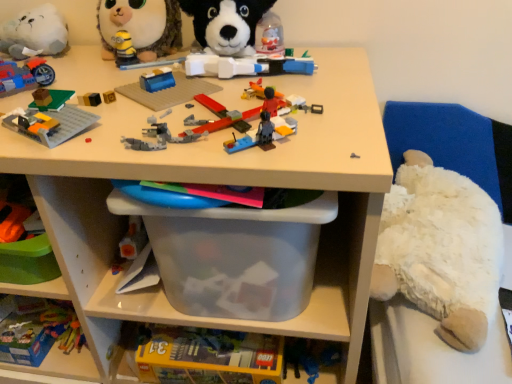
Identify the location of matte blue motorcycle at upper left, the 3th toy positioned from the left. The width and height of the screenshot is (512, 384). (24, 76).

Describe the element at coordinates (39, 331) in the screenshot. This screenshot has height=384, width=512. I see `translucent plastic lego box at lower left, the first toy when ordered from left to right` at that location.

In order to face translucent plastic lego box at lower left, the 8th toy positioned from the right, should I rotate leftwards or rightwards?

You should rotate left by 31.712 degrees.

The height and width of the screenshot is (384, 512). What do you see at coordinates (440, 250) in the screenshot?
I see `white fluffy teddy bear at right, which ranks as the first toy in right-to-left order` at bounding box center [440, 250].

Locate an element on the screen. matte blue motorcycle at upper left, the 3th toy positioned from the left is located at coordinates click(x=24, y=76).

From the picture: How many degrees apart are the facing directions of translucent plastic lego box at lower left, the first toy when ordered from left to right, and white plush cat at upper left, acting as the 2th toy starting from the left?

There is a 1.31-degree angle between the facing directions of translucent plastic lego box at lower left, the first toy when ordered from left to right, and white plush cat at upper left, acting as the 2th toy starting from the left.

Measure the distance from translucent plastic lego box at lower left, the 8th toy positioned from the right, to white plush cat at upper left, acting as the 2th toy starting from the left.

A distance of 21.14 inches exists between translucent plastic lego box at lower left, the 8th toy positioned from the right, and white plush cat at upper left, acting as the 2th toy starting from the left.

Locate an element on the screen. The width and height of the screenshot is (512, 384). toy behind the translucent plastic lego box at lower left, the first toy when ordered from left to right is located at coordinates (35, 33).

Considering the sizes of translucent plastic lego box at lower left, the 8th toy positioned from the right, and white plush cat at upper left, the seventh toy viewed from the right, in the image, is translucent plastic lego box at lower left, the 8th toy positioned from the right, taller or shorter than white plush cat at upper left, the seventh toy viewed from the right,?

Considering their sizes, translucent plastic lego box at lower left, the 8th toy positioned from the right, has less height than white plush cat at upper left, the seventh toy viewed from the right.

Measure the distance from matte blue motorcycle at upper left, the 3th toy positioned from the left, to fluffy plush toy at upper left, the fourth toy in the right-to-left sequence.

The distance of matte blue motorcycle at upper left, the 3th toy positioned from the left, from fluffy plush toy at upper left, the fourth toy in the right-to-left sequence, is 7.38 inches.

In terms of width, does matte blue motorcycle at upper left, the 3th toy positioned from the left, look wider or thinner when compared to fluffy plush toy at upper left, the fourth toy in the right-to-left sequence?

Clearly, matte blue motorcycle at upper left, the 3th toy positioned from the left, has less width compared to fluffy plush toy at upper left, the fourth toy in the right-to-left sequence.

Between matte blue motorcycle at upper left, the 3th toy positioned from the left, and fluffy plush toy at upper left, the fifth toy positioned from the left, which one is positioned in front?

matte blue motorcycle at upper left, the 3th toy positioned from the left, is closer to the camera.

Considering the sizes of matte blue motorcycle at upper left, arranged as the sixth toy when viewed from the right, and fluffy plush toy at upper left, the fourth toy in the right-to-left sequence, in the image, is matte blue motorcycle at upper left, arranged as the sixth toy when viewed from the right, taller or shorter than fluffy plush toy at upper left, the fourth toy in the right-to-left sequence,?

A: Clearly, matte blue motorcycle at upper left, arranged as the sixth toy when viewed from the right, is shorter compared to fluffy plush toy at upper left, the fourth toy in the right-to-left sequence.

This screenshot has height=384, width=512. I want to click on toy that is the 6th object located in front of the white plush cat at upper left, acting as the 2th toy starting from the left, so click(51, 120).

From the image's perspective, is translucent plastic baseplate at upper left, which is the fourth toy in left-to-right order, on white plush cat at upper left, acting as the 2th toy starting from the left?

Incorrect, from the image's perspective, translucent plastic baseplate at upper left, which is the fourth toy in left-to-right order, is lower than white plush cat at upper left, acting as the 2th toy starting from the left.

Is translucent plastic baseplate at upper left, which is the fourth toy in left-to-right order, looking in the opposite direction of white plush cat at upper left, acting as the 2th toy starting from the left?

No, translucent plastic baseplate at upper left, which is the fourth toy in left-to-right order, is not facing away from white plush cat at upper left, acting as the 2th toy starting from the left.

Is translucent plastic baseplate at upper left, the fifth toy from the right, far away from white plush cat at upper left, acting as the 2th toy starting from the left?

A: That's not correct — translucent plastic baseplate at upper left, the fifth toy from the right, is a little close to white plush cat at upper left, acting as the 2th toy starting from the left.

Can you confirm if white fluffy teddy bear at right, which ranks as the first toy in right-to-left order, is thinner than white plush dog at upper center, which is the 2th toy from right to left?

No.

Is white fluffy teddy bear at right, placed as the 8th toy when sorted from left to right, not inside white plush dog at upper center, the seventh toy viewed from the left?

Yes, white fluffy teddy bear at right, placed as the 8th toy when sorted from left to right, is located beyond the bounds of white plush dog at upper center, the seventh toy viewed from the left.

Considering the points (475, 295) and (260, 55), which point is in front, point (475, 295) or point (260, 55)?

The point (475, 295) is more forward.

Measure the distance from white fluffy teddy bear at right, which ranks as the first toy in right-to-left order, to white plush dog at upper center, which is the 2th toy from right to left.

A distance of 15.53 inches exists between white fluffy teddy bear at right, which ranks as the first toy in right-to-left order, and white plush dog at upper center, which is the 2th toy from right to left.

How many degrees apart are the facing directions of clear plastic bin at center and white plush at right?

The angular difference between clear plastic bin at center and white plush at right is 0.377 degrees.

Measure the distance from clear plastic bin at center to white plush at right.

clear plastic bin at center and white plush at right are 16.75 inches apart from each other.

Considering the sizes of objects clear plastic bin at center and white plush at right in the image provided, who is wider, clear plastic bin at center or white plush at right?

clear plastic bin at center.

Could you tell me if clear plastic bin at center is turned towards white plush at right?

No, clear plastic bin at center is not facing towards white plush at right.

Considering the sizes of objects translucent plastic lego box at lower left, the first toy when ordered from left to right, and white plush at right in the image provided, who is wider, translucent plastic lego box at lower left, the first toy when ordered from left to right, or white plush at right?

With larger width is translucent plastic lego box at lower left, the first toy when ordered from left to right.

From a real-world perspective, is translucent plastic lego box at lower left, the first toy when ordered from left to right, located beneath white plush at right?

Yes.

Is translucent plastic lego box at lower left, the 8th toy positioned from the right, spatially inside white plush at right, or outside of it?

translucent plastic lego box at lower left, the 8th toy positioned from the right, is located beyond the bounds of white plush at right.

Considering the sizes of objects translucent plastic lego box at lower left, the first toy when ordered from left to right, and white plush at right in the image provided, who is taller, translucent plastic lego box at lower left, the first toy when ordered from left to right, or white plush at right?

With more height is white plush at right.

How many degrees apart are the facing directions of white plush at right and clear plastic bin at center?

The angle between the facing direction of white plush at right and the facing direction of clear plastic bin at center is 0.377 degrees.

Looking at this image, from a real-world perspective, is white plush at right under clear plastic bin at center?

No, from a real-world perspective, white plush at right is not beneath clear plastic bin at center.

In the scene shown: Is there a large distance between white plush at right and clear plastic bin at center?

No, white plush at right is not far away from clear plastic bin at center.

Considering the relative positions of white plush at right and clear plastic bin at center in the image provided, is white plush at right to the left or to the right of clear plastic bin at center?

white plush at right is to the right of clear plastic bin at center.

You are a GUI agent. You are given a task and a screenshot of the screen. Output one action in this format:
    pyautogui.click(x=<x>, y=<y>)
    Task: Click on the 1st toy in front of the white plush cat at upper left, the seventh toy viewed from the right, starting your count from the anchor
    The image size is (512, 384).
    Given the screenshot: What is the action you would take?
    pyautogui.click(x=39, y=331)

Where is `toy that is the 3rd object directly below the fluffy plush toy at upper left, the fifth toy positioned from the left (from a real-world perspective)`? This screenshot has width=512, height=384. toy that is the 3rd object directly below the fluffy plush toy at upper left, the fifth toy positioned from the left (from a real-world perspective) is located at coordinates (24, 76).

Looking at the image, which one is located further to white plush dog at upper center, which is the 2th toy from right to left, translucent plastic lego box at lower left, the first toy when ordered from left to right, or white plush cat at upper left, the seventh toy viewed from the right?

translucent plastic lego box at lower left, the first toy when ordered from left to right, is positioned further to the anchor white plush dog at upper center, which is the 2th toy from right to left.

Looking at the image, which one is located closer to matte blue motorcycle at upper left, the 3th toy positioned from the left, clear plastic bin at center or translucent plastic airplane at center, arranged as the 3th toy when viewed from the right?

translucent plastic airplane at center, arranged as the 3th toy when viewed from the right, is closer to matte blue motorcycle at upper left, the 3th toy positioned from the left.

Based on their spatial positions, is white fluffy teddy bear at right, which ranks as the first toy in right-to-left order, or translucent plastic airplane at center, which is the 6th toy from left to right, closer to white plush dog at upper center, the seventh toy viewed from the left?

translucent plastic airplane at center, which is the 6th toy from left to right, is positioned closer to the anchor white plush dog at upper center, the seventh toy viewed from the left.

Which object lies further to the anchor point translucent plastic baseplate at upper left, which is the fourth toy in left-to-right order, translucent plastic airplane at center, arranged as the 3th toy when viewed from the right, or matte blue motorcycle at upper left, the 3th toy positioned from the left?

Among the two, translucent plastic airplane at center, arranged as the 3th toy when viewed from the right, is located further to translucent plastic baseplate at upper left, which is the fourth toy in left-to-right order.

Looking at the image, which one is located further to matte blue motorcycle at upper left, the 3th toy positioned from the left, fluffy plush toy at upper left, the fifth toy positioned from the left, or translucent plastic baseplate at upper left, which is the fourth toy in left-to-right order?

fluffy plush toy at upper left, the fifth toy positioned from the left, lies further to matte blue motorcycle at upper left, the 3th toy positioned from the left, than the other object.

From the image, which object appears to be nearer to translucent plastic lego box at lower left, the 8th toy positioned from the right, matte blue motorcycle at upper left, arranged as the sixth toy when viewed from the right, or white plush at right?

matte blue motorcycle at upper left, arranged as the sixth toy when viewed from the right, lies closer to translucent plastic lego box at lower left, the 8th toy positioned from the right, than the other object.

Estimate the real-world distances between objects in this image. Which object is further from translucent plastic airplane at center, which is the 6th toy from left to right, white fluffy teddy bear at right, placed as the 8th toy when sorted from left to right, or translucent plastic lego box at lower left, the first toy when ordered from left to right?

Among the two, translucent plastic lego box at lower left, the first toy when ordered from left to right, is located further to translucent plastic airplane at center, which is the 6th toy from left to right.

Estimate the real-world distances between objects in this image. Which object is closer to fluffy plush toy at upper left, the fourth toy in the right-to-left sequence, white plush dog at upper center, the seventh toy viewed from the left, or translucent plastic lego box at lower left, the 8th toy positioned from the right?

white plush dog at upper center, the seventh toy viewed from the left.

Where is `shelf situated between matte blue motorcycle at upper left, arranged as the sixth toy when viewed from the right, and white plush at right from left to right`? shelf situated between matte blue motorcycle at upper left, arranged as the sixth toy when viewed from the right, and white plush at right from left to right is located at coordinates (219, 183).

This screenshot has height=384, width=512. Find the location of `shelf between white plush dog at upper center, which is the 2th toy from right to left, and translucent plastic lego box at lower left, the first toy when ordered from left to right, from top to bottom`. shelf between white plush dog at upper center, which is the 2th toy from right to left, and translucent plastic lego box at lower left, the first toy when ordered from left to right, from top to bottom is located at coordinates pyautogui.click(x=219, y=183).

Where is `shelf between translucent plastic baseplate at upper left, the fifth toy from the right, and translucent plastic lego box at lower left, the 8th toy positioned from the right, from top to bottom`? Image resolution: width=512 pixels, height=384 pixels. shelf between translucent plastic baseplate at upper left, the fifth toy from the right, and translucent plastic lego box at lower left, the 8th toy positioned from the right, from top to bottom is located at coordinates pos(219,183).

Locate an element on the screen. shelf between fluffy plush toy at upper left, the fifth toy positioned from the left, and translucent plastic lego box at lower left, the 8th toy positioned from the right, in the up-down direction is located at coordinates (219, 183).